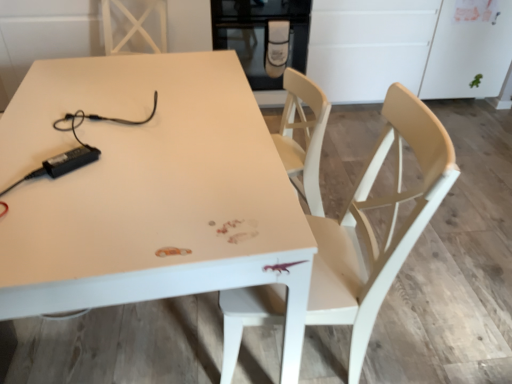
Question: Does black glass oven at upper center have a greater width compared to light wood chair at center?

Choices:
 (A) yes
 (B) no

Answer: (A)

Question: From a real-world perspective, is black glass oven at upper center beneath light wood chair at center?

Choices:
 (A) no
 (B) yes

Answer: (A)

Question: Is black glass oven at upper center behind light wood chair at center?

Choices:
 (A) no
 (B) yes

Answer: (B)

Question: Does black glass oven at upper center appear on the right side of light wood chair at center?

Choices:
 (A) yes
 (B) no

Answer: (B)

Question: Would you say light wood chair at center is part of black glass oven at upper center's contents?

Choices:
 (A) yes
 (B) no

Answer: (B)

Question: Looking at their shapes, would you say black glass oven at upper center is wider or thinner than light wood chair at center?

Choices:
 (A) thin
 (B) wide

Answer: (B)

Question: Which is correct: black glass oven at upper center is inside light wood chair at center, or outside of it?

Choices:
 (A) inside
 (B) outside

Answer: (B)

Question: Does point (281, 1) appear closer or farther from the camera than point (329, 225)?

Choices:
 (A) closer
 (B) farther

Answer: (B)

Question: Is black glass oven at upper center to the left or to the right of light wood chair at center in the image?

Choices:
 (A) right
 (B) left

Answer: (B)

Question: Is white glossy table at center bigger or smaller than light wood chair at center?

Choices:
 (A) small
 (B) big

Answer: (B)

Question: From a real-world perspective, is white glossy table at center positioned above or below light wood chair at center?

Choices:
 (A) below
 (B) above

Answer: (A)

Question: From the image's perspective, relative to light wood chair at center, is white glossy table at center above or below?

Choices:
 (A) above
 (B) below

Answer: (A)

Question: In terms of width, does white glossy table at center look wider or thinner when compared to light wood chair at center?

Choices:
 (A) wide
 (B) thin

Answer: (A)

Question: Is light wood chair at center bigger or smaller than white glossy table at center?

Choices:
 (A) big
 (B) small

Answer: (B)

Question: From a real-world perspective, is light wood chair at center above or below white glossy table at center?

Choices:
 (A) above
 (B) below

Answer: (A)